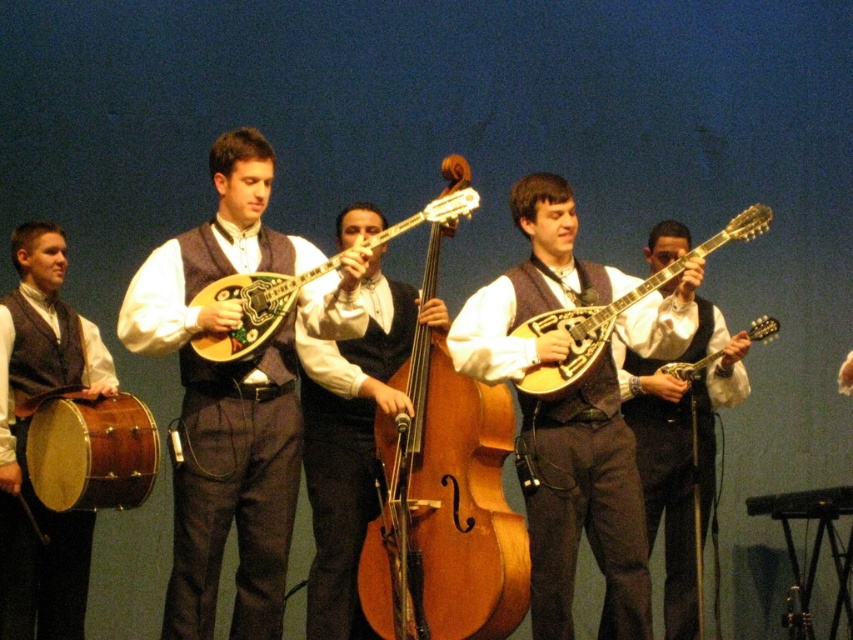
Is point (229, 470) positioned before point (703, 310)?

Yes, point (229, 470) is closer to viewer.

The image size is (853, 640). What do you see at coordinates (234, 394) in the screenshot? I see `matte wood mandolin at center` at bounding box center [234, 394].

Locate an element on the screen. matte wood mandolin at center is located at coordinates [x=234, y=394].

From the picture: Measure the distance between point (x=141, y=330) and camera.

The distance of point (x=141, y=330) from camera is 7.56 meters.

What do you see at coordinates (234, 394) in the screenshot? Image resolution: width=853 pixels, height=640 pixels. I see `matte wood mandolin at center` at bounding box center [234, 394].

Locate an element on the screen. Image resolution: width=853 pixels, height=640 pixels. matte wood mandolin at center is located at coordinates (234, 394).

Between matte brown mandolin at center and matte brown drum at left, which one appears on the right side from the viewer's perspective?

matte brown mandolin at center is more to the right.

Is matte brown mandolin at center below matte brown drum at left?

No.

Is point (573, 285) closer to camera compared to point (47, 232)?

Yes, point (573, 285) is in front of point (47, 232).

Image resolution: width=853 pixels, height=640 pixels. Identify the location of matte brown mandolin at center. (583, 504).